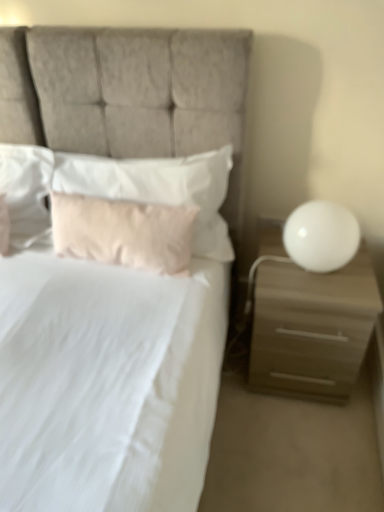
Question: From the image's perspective, is white soft pillow at upper left, which is the 3th pillow from right to left, located above white glossy sphere at right?

Choices:
 (A) no
 (B) yes

Answer: (B)

Question: Can you confirm if white soft pillow at upper left, placed as the first pillow when sorted from left to right, is smaller than white glossy sphere at right?

Choices:
 (A) no
 (B) yes

Answer: (A)

Question: Would you say white soft pillow at upper left, placed as the first pillow when sorted from left to right, is outside white glossy sphere at right?

Choices:
 (A) yes
 (B) no

Answer: (A)

Question: Is white soft pillow at upper left, which is the 3th pillow from right to left, thinner than white glossy sphere at right?

Choices:
 (A) no
 (B) yes

Answer: (B)

Question: Is white soft pillow at upper left, placed as the first pillow when sorted from left to right, far away from white glossy sphere at right?

Choices:
 (A) yes
 (B) no

Answer: (A)

Question: From the image's perspective, is white soft pillow at upper left, placed as the first pillow when sorted from left to right, above or below soft pink pillow at center, arranged as the 1th pillow when viewed from the right?

Choices:
 (A) below
 (B) above

Answer: (B)

Question: Would you say white soft pillow at upper left, placed as the first pillow when sorted from left to right, is inside or outside soft pink pillow at center, which is the 3th pillow in left-to-right order?

Choices:
 (A) outside
 (B) inside

Answer: (A)

Question: In terms of height, does white soft pillow at upper left, which is the 3th pillow from right to left, look taller or shorter compared to soft pink pillow at center, arranged as the 1th pillow when viewed from the right?

Choices:
 (A) short
 (B) tall

Answer: (A)

Question: Considering the positions of white soft pillow at upper left, placed as the first pillow when sorted from left to right, and soft pink pillow at center, arranged as the 1th pillow when viewed from the right, in the image, is white soft pillow at upper left, placed as the first pillow when sorted from left to right, bigger or smaller than soft pink pillow at center, arranged as the 1th pillow when viewed from the right,?

Choices:
 (A) big
 (B) small

Answer: (B)

Question: Is point (122, 223) closer or farther from the camera than point (64, 162)?

Choices:
 (A) farther
 (B) closer

Answer: (B)

Question: In terms of size, does pink fabric pillow at center, which is the 2th pillow in left-to-right order, appear bigger or smaller than soft pink pillow at center, arranged as the 1th pillow when viewed from the right?

Choices:
 (A) small
 (B) big

Answer: (A)

Question: Do you think pink fabric pillow at center, acting as the second pillow starting from the right, is within soft pink pillow at center, arranged as the 1th pillow when viewed from the right, or outside of it?

Choices:
 (A) inside
 (B) outside

Answer: (A)

Question: Is pink fabric pillow at center, acting as the second pillow starting from the right, to the left or to the right of soft pink pillow at center, which is the 3th pillow in left-to-right order, in the image?

Choices:
 (A) right
 (B) left

Answer: (B)

Question: Looking at the image, does pink fabric pillow at center, acting as the second pillow starting from the right, seem bigger or smaller compared to matte beige nightstand at right?

Choices:
 (A) big
 (B) small

Answer: (B)

Question: From a real-world perspective, is pink fabric pillow at center, which is the 2th pillow in left-to-right order, physically located above or below matte beige nightstand at right?

Choices:
 (A) below
 (B) above

Answer: (B)